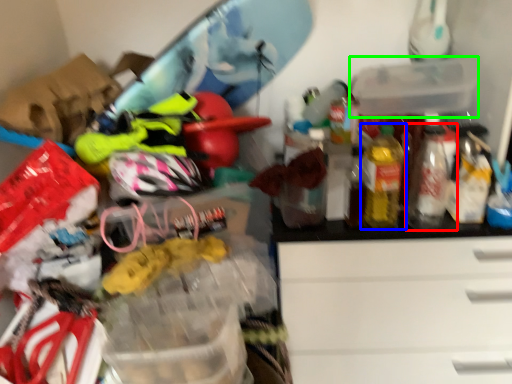
Question: Based on their relative distances, which object is farther from bottle (highlighted by a red box)? Choose from bottle (highlighted by a blue box) and storage box (highlighted by a green box).

Choices:
 (A) bottle
 (B) storage box

Answer: (B)